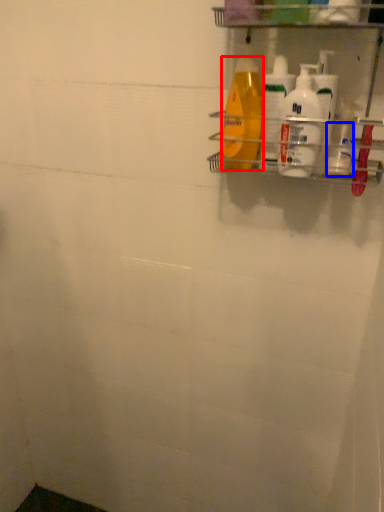
Question: Among these objects, which one is farthest to the camera, cleaning product (highlighted by a red box) or toiletry (highlighted by a blue box)?

Choices:
 (A) cleaning product
 (B) toiletry

Answer: (B)